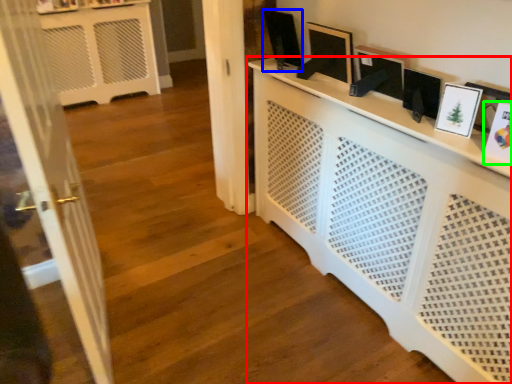
Question: Estimate the real-world distances between objects in this image. Which object is closer to furniture (highlighted by a red box), picture frame (highlighted by a blue box) or picture frame (highlighted by a green box)?

Choices:
 (A) picture frame
 (B) picture frame

Answer: (B)